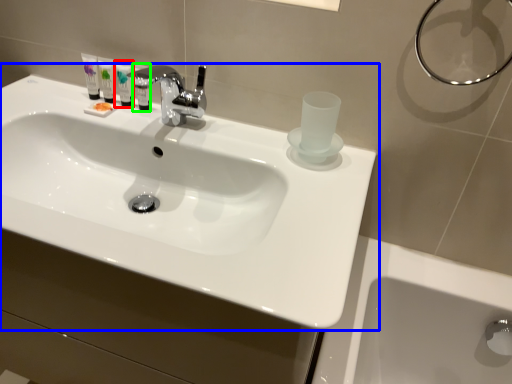
Question: Considering the real-world distances, which object is farthest from mouthwash (highlighted by a red box)? sink (highlighted by a blue box) or mouthwash (highlighted by a green box)?

Choices:
 (A) sink
 (B) mouthwash

Answer: (A)